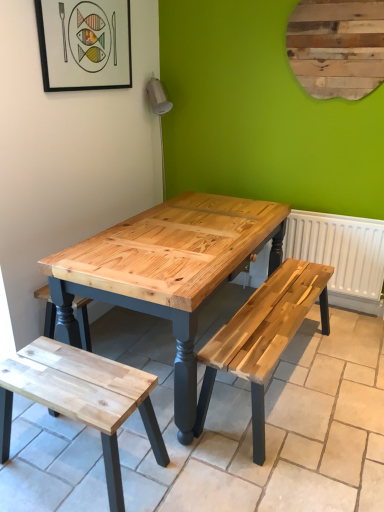
Question: Is natural wood bench at lower left at the left side of matte black picture frame at upper left?

Choices:
 (A) yes
 (B) no

Answer: (B)

Question: Is matte black picture frame at upper left a part of natural wood bench at lower left?

Choices:
 (A) no
 (B) yes

Answer: (A)

Question: Is the depth of natural wood bench at lower left greater than that of matte black picture frame at upper left?

Choices:
 (A) yes
 (B) no

Answer: (B)

Question: Is natural wood bench at lower left smaller than matte black picture frame at upper left?

Choices:
 (A) yes
 (B) no

Answer: (B)

Question: Considering the relative positions of natural wood bench at lower left and matte black picture frame at upper left in the image provided, is natural wood bench at lower left to the right of matte black picture frame at upper left from the viewer's perspective?

Choices:
 (A) yes
 (B) no

Answer: (A)

Question: Is white matte radiator at right in front of or behind matte black picture frame at upper left in the image?

Choices:
 (A) behind
 (B) front

Answer: (A)

Question: From the image's perspective, is white matte radiator at right positioned above or below matte black picture frame at upper left?

Choices:
 (A) above
 (B) below

Answer: (B)

Question: From a real-world perspective, is white matte radiator at right above or below matte black picture frame at upper left?

Choices:
 (A) above
 (B) below

Answer: (B)

Question: Considering the positions of white matte radiator at right and matte black picture frame at upper left in the image, is white matte radiator at right bigger or smaller than matte black picture frame at upper left?

Choices:
 (A) small
 (B) big

Answer: (B)

Question: From a real-world perspective, is natural wood bench at lower left physically located above or below matte black picture frame at upper left?

Choices:
 (A) above
 (B) below

Answer: (B)

Question: In the image, is natural wood bench at lower left positioned in front of or behind matte black picture frame at upper left?

Choices:
 (A) behind
 (B) front

Answer: (B)

Question: Looking at their shapes, would you say natural wood bench at lower left is wider or thinner than matte black picture frame at upper left?

Choices:
 (A) wide
 (B) thin

Answer: (A)

Question: From their relative heights in the image, would you say natural wood bench at lower left is taller or shorter than matte black picture frame at upper left?

Choices:
 (A) short
 (B) tall

Answer: (A)

Question: Would you say wooden plaque at upper right is to the left or to the right of white matte radiator at right in the picture?

Choices:
 (A) left
 (B) right

Answer: (A)

Question: Looking at the image, does wooden plaque at upper right seem bigger or smaller compared to white matte radiator at right?

Choices:
 (A) small
 (B) big

Answer: (A)